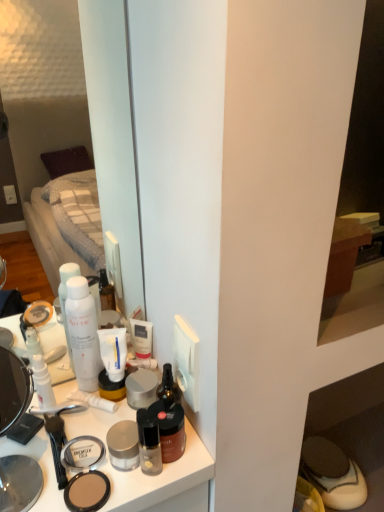
This screenshot has height=512, width=384. Identify the location of free spot in front of transparent plastic mirror at upper left. (84, 437).